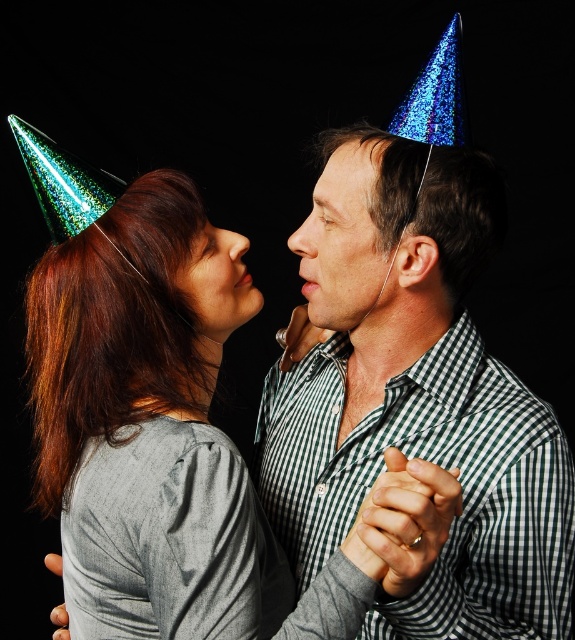
Question: Among these objects, which one is farthest from the camera?

Choices:
 (A) matte green party hat at center
 (B) shiny metallic forehead at center
 (C) shiny blue party hat at center

Answer: (B)

Question: Is matte green party hat at center wider than shiny metallic forehead at center?

Choices:
 (A) no
 (B) yes

Answer: (B)

Question: Is matte green party hat at center closer to camera compared to shiny metallic forehead at center?

Choices:
 (A) no
 (B) yes

Answer: (B)

Question: Is matte green party hat at center smaller than matte skin at center?

Choices:
 (A) yes
 (B) no

Answer: (B)

Question: Which object is positioned closest to the matte green party hat at center?

Choices:
 (A) matte skin at center
 (B) shiny blue party hat at center

Answer: (A)

Question: Which point is closer to the camera?

Choices:
 (A) shiny blue party hat at center
 (B) matte green party hat at center

Answer: (A)